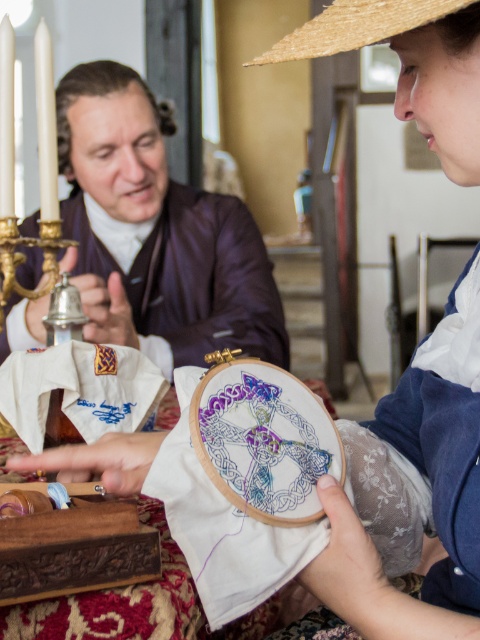
You are a visitor observing two people engaged in a craft activity. You notice a purple silk jacket at upper center and a straw hat at upper center. Which object is closer to you?

The purple silk jacket at upper center is closer to you because it is further to the viewer than the straw hat at upper center.

What is the exact 2D coordinate of the purple silk jacket at upper center in the image?

The purple silk jacket at upper center is located at the 2D coordinate point of (x=156, y=232).

You are a tailor who needs to choose between the purple silk jacket at upper center and the straw hat at upper center to display in a small showcase. Which item should you choose based on their sizes?

The purple silk jacket at upper center has a larger size compared to the straw hat at upper center, so it would be more suitable to display the purple silk jacket at upper center in the small showcase as it can better fill the space.